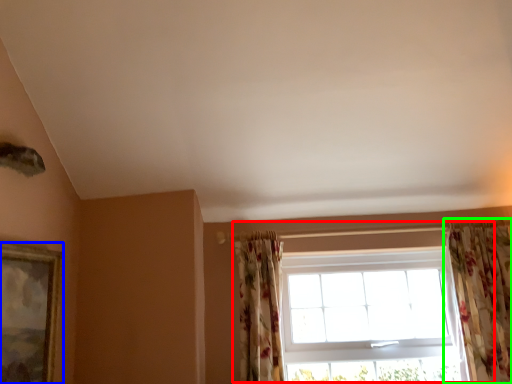
Question: Which object is the farthest from window (highlighted by a red box)? Choose among these: picture frame (highlighted by a blue box) or curtain (highlighted by a green box).

Choices:
 (A) picture frame
 (B) curtain

Answer: (A)